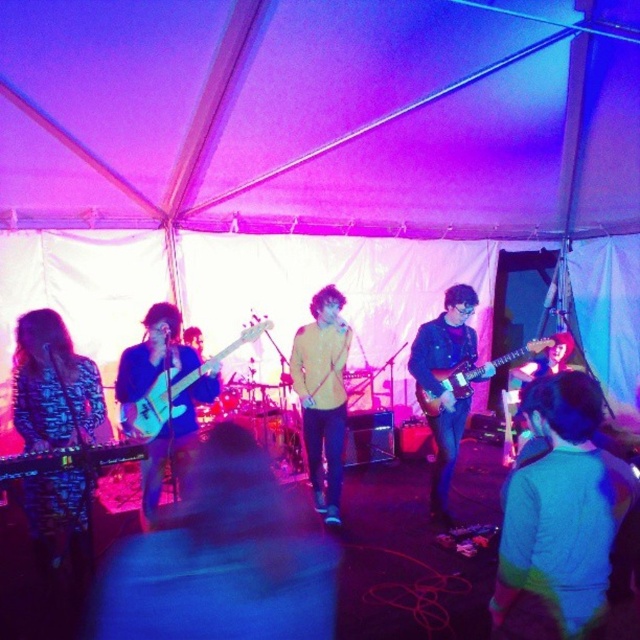
You are standing at the entrance of the tented venue and see two points marked in the image. Which point is closer to you? The points are point [317,385] and point [182,438].

Point [182,438] is closer to you because it is in front of point [317,385].

What is located at the coordinate point (52,385) in the image?

The printed fabric dress at left is located at the coordinate point (52,385).